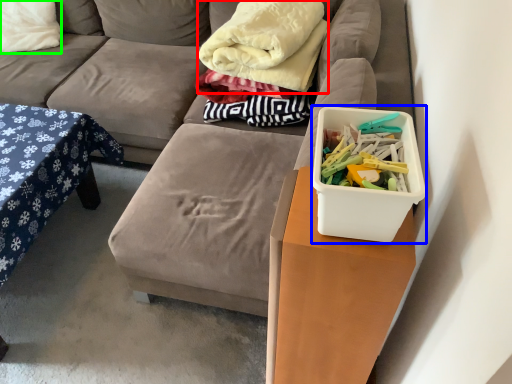
Question: Which object is the closest to the blanket (highlighted by a red box)? Choose among these: storage box (highlighted by a blue box) or pillow (highlighted by a green box).

Choices:
 (A) storage box
 (B) pillow

Answer: (A)